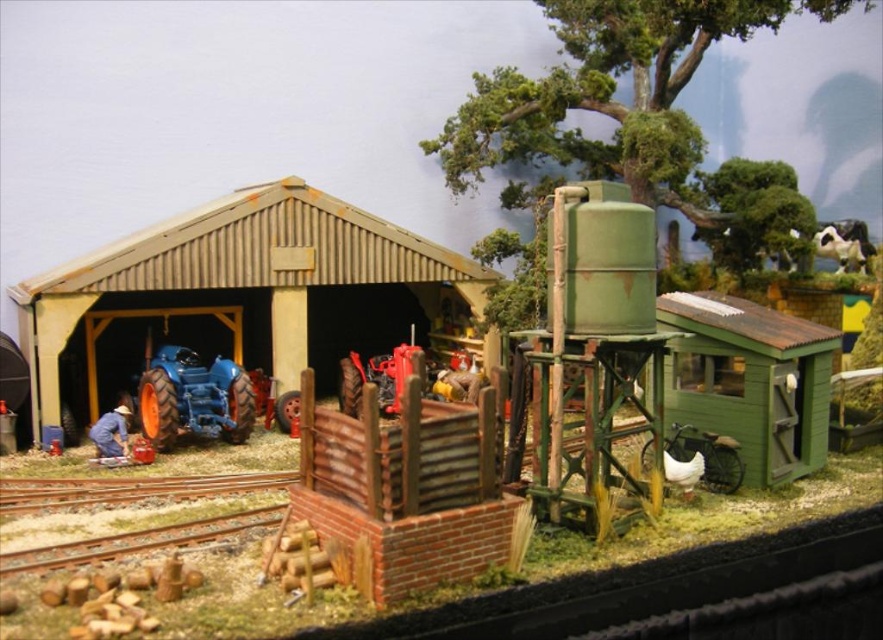
You are designing a new layout for the farm and need to place a large equipment storage unit. Which object, the rustic wood shed at center or the smooth metal tracks at lower left, has more space available for this purpose?

The rustic wood shed at center is bigger than the smooth metal tracks at lower left, so it has more space available for placing the large equipment storage unit.

You are standing in the miniature farm diorama. There are two points marked in the scene. The first point is at coordinates point (343,216) and the second point is at point (853,224). Which of these two points is closer to you?

Point (343,216) is closer to the viewer than point (853,224).